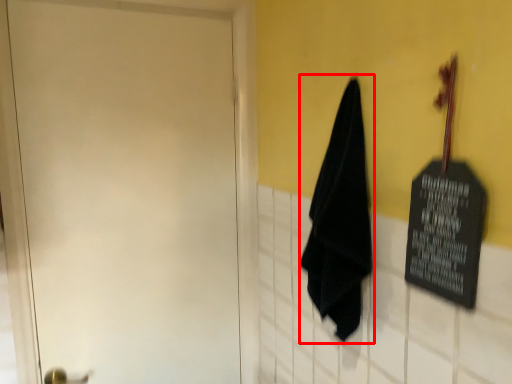
Question: From the image's perspective, where is cloth (annotated by the red box) located relative to door?

Choices:
 (A) above
 (B) below

Answer: (A)